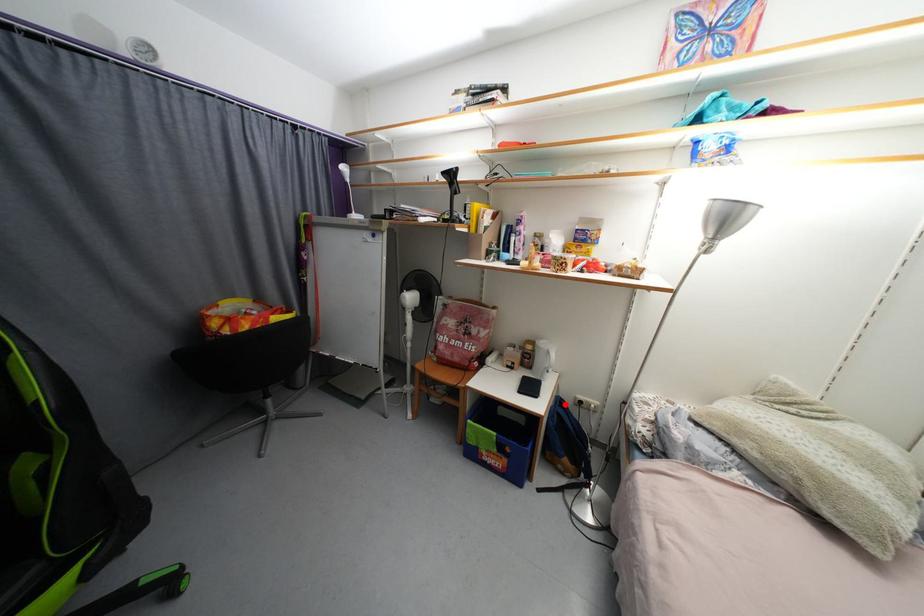
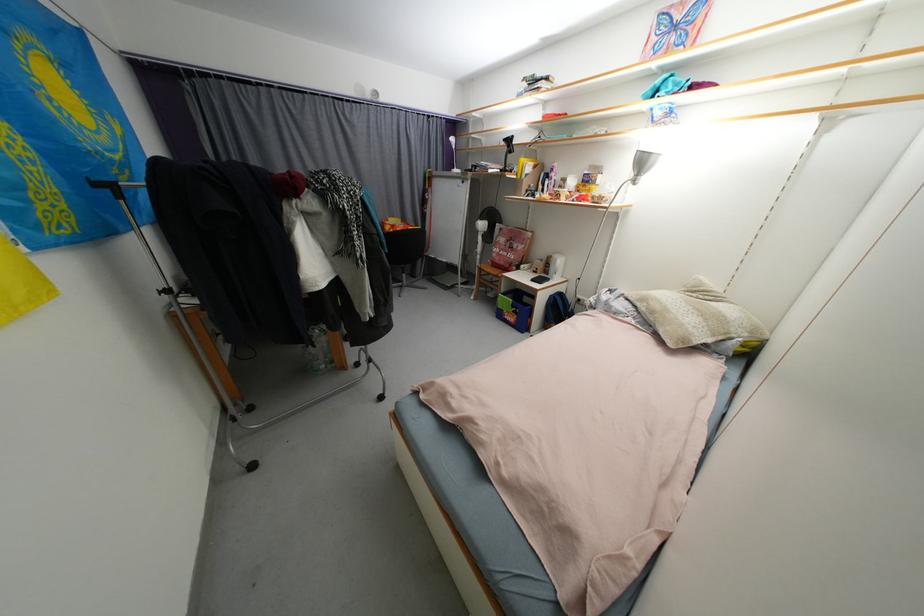
In the second image, find the point that corresponds to the highlighted location in the first image.

(565, 297)